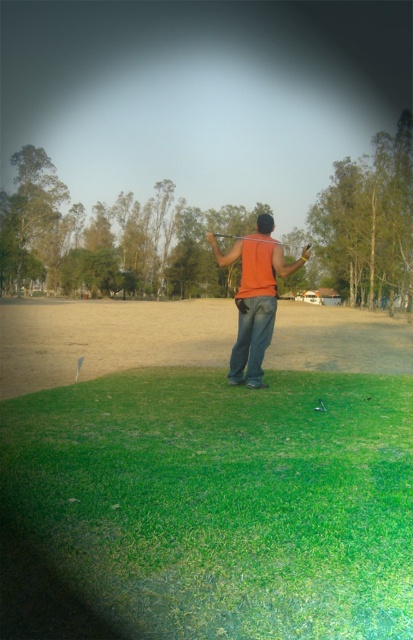
Question: Can you confirm if brown sandy dirt field at center is wider than orange fabric shirt at center?

Choices:
 (A) no
 (B) yes

Answer: (B)

Question: Can you confirm if green grassy field at lower center is positioned above brown sandy dirt field at center?

Choices:
 (A) no
 (B) yes

Answer: (A)

Question: Which object appears farthest from the camera in this image?

Choices:
 (A) brown sandy dirt field at center
 (B) orange fabric shirt at center

Answer: (A)

Question: Which point is farther to the camera?

Choices:
 (A) (263, 326)
 (B) (61, 576)
 (C) (71, 304)

Answer: (C)

Question: Which of the following is the closest to the observer?

Choices:
 (A) (104, 323)
 (B) (247, 330)
 (C) (128, 522)

Answer: (C)

Question: Is green grassy field at lower center to the right of orange fabric shirt at center from the viewer's perspective?

Choices:
 (A) no
 (B) yes

Answer: (A)